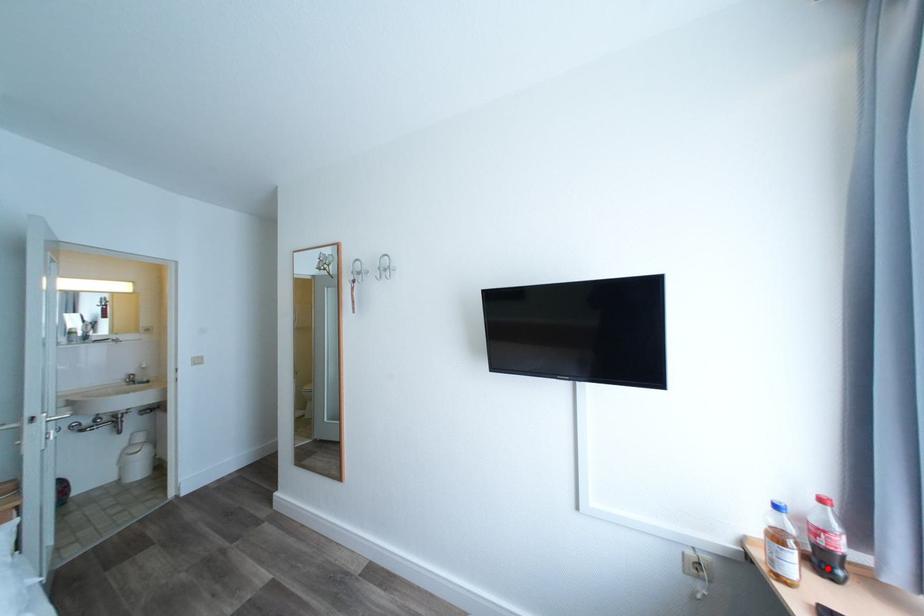
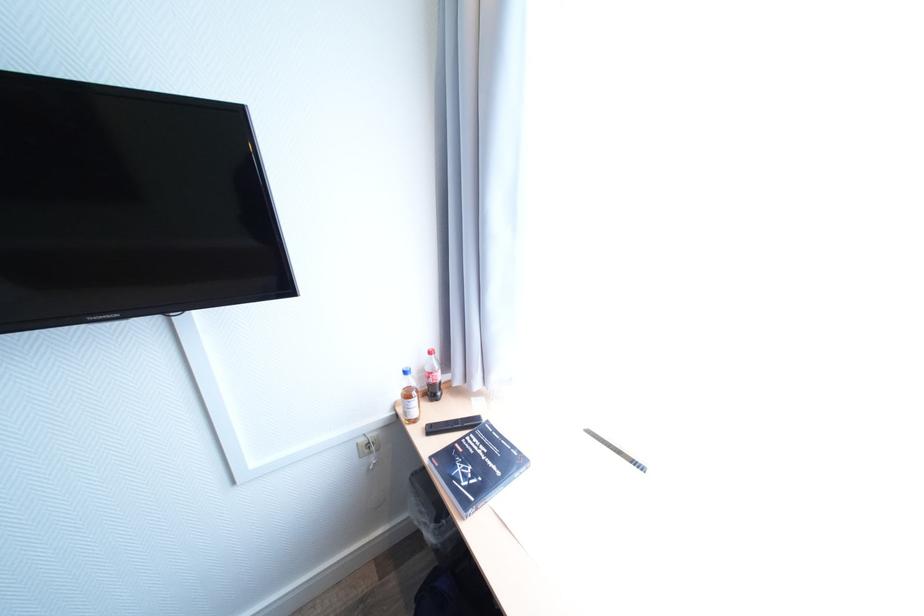
The point at the highlighted location is marked in the first image. Where is the corresponding point in the second image?

(439, 397)